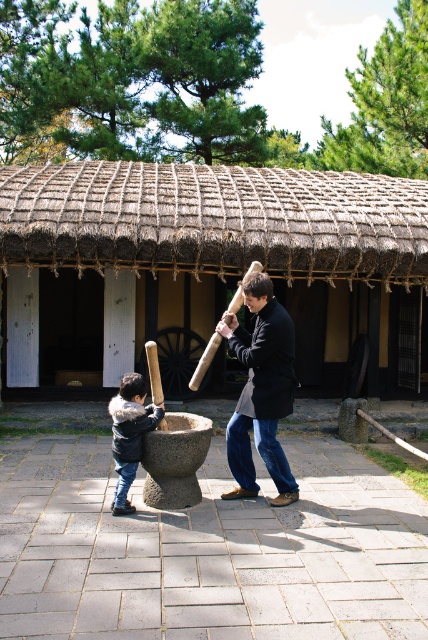
Question: Is smooth gray mortar at center to the right of dark blue leather jacket at center from the viewer's perspective?

Choices:
 (A) no
 (B) yes

Answer: (B)

Question: Which is farther from the dark blue leather jacket at center?

Choices:
 (A) wooden baseball bat at center
 (B) dark brown leather jacket at center
 (C) wooden baseball bat at lower center

Answer: (B)

Question: Can you confirm if dark brown leather jacket at center is positioned to the left of wooden baseball bat at lower center?

Choices:
 (A) no
 (B) yes

Answer: (A)

Question: Does smooth gray mortar at center appear over wooden baseball bat at lower center?

Choices:
 (A) yes
 (B) no

Answer: (B)

Question: Among these points, which one is farthest from the camera?

Choices:
 (A) (345, 332)
 (B) (166, 429)
 (C) (119, 452)
 (D) (243, 406)

Answer: (A)

Question: Among these objects, which one is nearest to the camera?

Choices:
 (A) dark blue leather jacket at center
 (B) smooth gray mortar at center

Answer: (B)